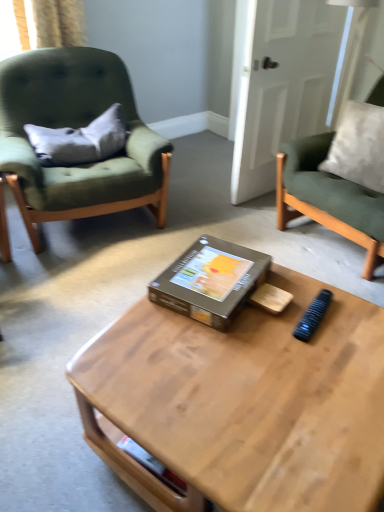
Question: Visually, is green fabric chair at left, arranged as the 1th chair when viewed from the left, positioned to the left or to the right of gray fabric pillow at left?

Choices:
 (A) left
 (B) right

Answer: (A)

Question: Is green fabric chair at left, the second chair from the right, inside the boundaries of gray fabric pillow at left, or outside?

Choices:
 (A) inside
 (B) outside

Answer: (B)

Question: Estimate the real-world distances between objects in this image. Which object is farther from the gray fabric pillow at left?

Choices:
 (A) velvet green chair at right, positioned as the 2th chair in left-to-right order
 (B) black plastic remote control at center
 (C) green fabric chair at left, the second chair from the right
 (D) brown cardboard box at center
 (E) wooden coffee table at center

Answer: (B)

Question: Which object is the closest to the gray fabric pillow at left?

Choices:
 (A) brown cardboard box at center
 (B) green fabric chair at left, arranged as the 1th chair when viewed from the left
 (C) velvet green chair at right, which appears as the 1th chair when viewed from the right
 (D) black plastic remote control at center
 (E) wooden coffee table at center

Answer: (B)